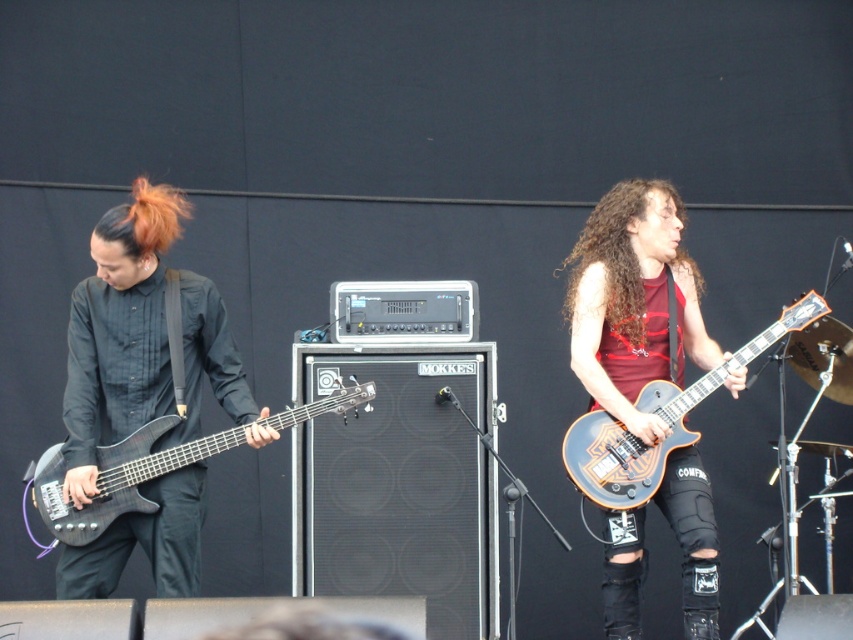
You are a photographer at the live music performance. You want to capture a photo where the shiny orange guitar at center and the shiny orange hair at left are both visible. Based on their heights, which object should you ensure is placed lower in the frame to avoid being cut off?

The shiny orange guitar at center is taller than the shiny orange hair at left, so to avoid being cut off, the shiny orange guitar at center should be placed lower in the frame.

Looking at this image, you are a photographer at the concert and want to take a photo that includes both the matte black electric guitar at right and the shiny orange hair at left. Since you want the guitar to appear larger in the photo than the hair, where should you position the camera relative to each object?

The matte black electric guitar at right is much taller than the shiny orange hair at left, so positioning the camera closer to the matte black electric guitar at right will make it appear larger in the photo compared to the shiny orange hair at left.

Based on the photo, you are a stage technician and need to place a spotlight on the matte black bass guitar at left. The stage coordinates are mapped from 0 to 1, where 0 is the bottom left corner. What are the coordinates where you should position the spotlight?

The coordinates for the matte black bass guitar at left are at point (119, 332), so you should position the spotlight at those coordinates.